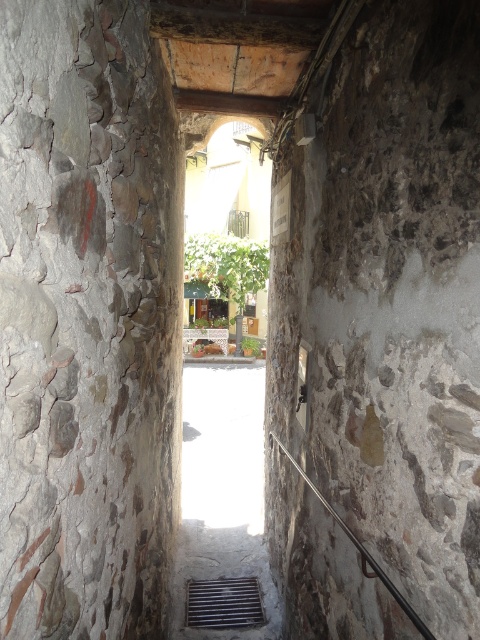
Who is taller, metallic grate at lower center or black metal rail at lower center?

black metal rail at lower center

Between metallic grate at lower center and black metal rail at lower center, which one appears on the left side from the viewer's perspective?

From the viewer's perspective, metallic grate at lower center appears more on the left side.

Is point (252, 595) behind point (277, 438)?

Yes, it is.

In order to click on metallic grate at lower center in this screenshot , I will do `click(224, 604)`.